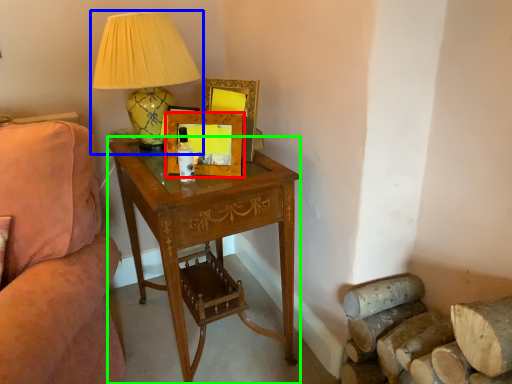
Question: Considering the real-world distances, which object is closest to picture frame (highlighted by a red box)? lamp (highlighted by a blue box) or desk (highlighted by a green box).

Choices:
 (A) lamp
 (B) desk

Answer: (A)